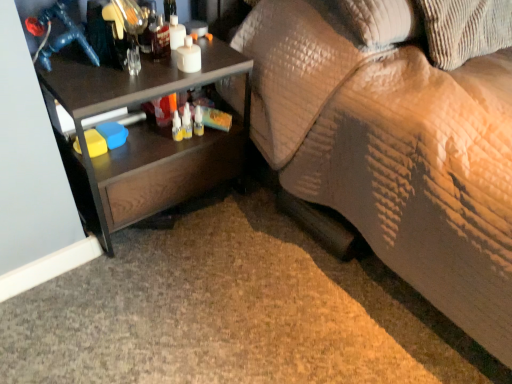
Question: Can textured beige couch at lower right be found inside brown corduroy pillow at upper right?

Choices:
 (A) yes
 (B) no

Answer: (B)

Question: From a real-world perspective, is brown corduroy pillow at upper right beneath textured beige couch at lower right?

Choices:
 (A) no
 (B) yes

Answer: (A)

Question: Can you confirm if brown corduroy pillow at upper right is positioned to the left of textured beige couch at lower right?

Choices:
 (A) yes
 (B) no

Answer: (A)

Question: Is brown corduroy pillow at upper right positioned behind textured beige couch at lower right?

Choices:
 (A) no
 (B) yes

Answer: (B)

Question: Can you confirm if brown corduroy pillow at upper right is taller than textured beige couch at lower right?

Choices:
 (A) yes
 (B) no

Answer: (B)

Question: Is brown corduroy pillow at upper right to the right of textured beige couch at lower right from the viewer's perspective?

Choices:
 (A) no
 (B) yes

Answer: (A)

Question: Is dark wood desk at left thinner than brown corduroy pillow at upper right?

Choices:
 (A) yes
 (B) no

Answer: (A)

Question: Is dark wood desk at left with brown corduroy pillow at upper right?

Choices:
 (A) no
 (B) yes

Answer: (A)

Question: Considering the relative sizes of dark wood desk at left and brown corduroy pillow at upper right in the image provided, is dark wood desk at left shorter than brown corduroy pillow at upper right?

Choices:
 (A) no
 (B) yes

Answer: (A)

Question: Could you tell me if dark wood desk at left is facing brown corduroy pillow at upper right?

Choices:
 (A) yes
 (B) no

Answer: (B)

Question: Is dark wood desk at left outside brown corduroy pillow at upper right?

Choices:
 (A) yes
 (B) no

Answer: (A)

Question: Considering the relative sizes of dark wood desk at left and brown corduroy pillow at upper right in the image provided, is dark wood desk at left taller than brown corduroy pillow at upper right?

Choices:
 (A) no
 (B) yes

Answer: (B)

Question: From a real-world perspective, is textured beige couch at lower right below brown corduroy pillow at upper right?

Choices:
 (A) yes
 (B) no

Answer: (A)